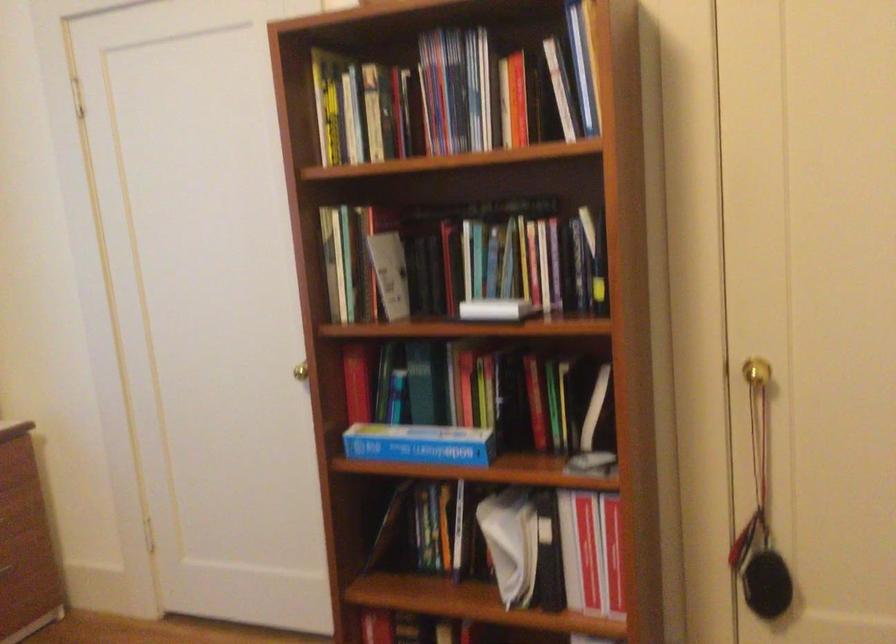
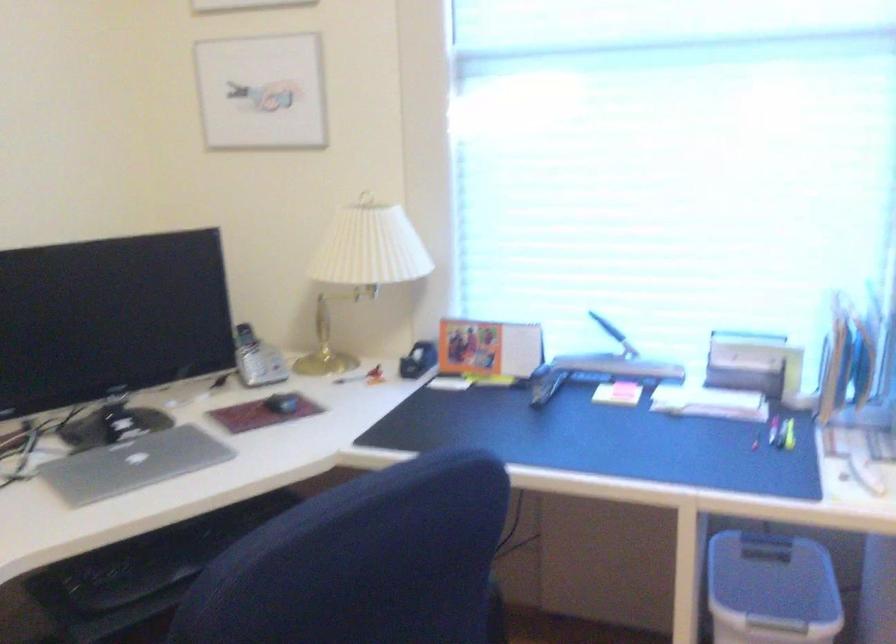
The images are taken continuously from a first-person perspective. In which direction is your viewpoint rotating?

The camera rotated toward left-down.